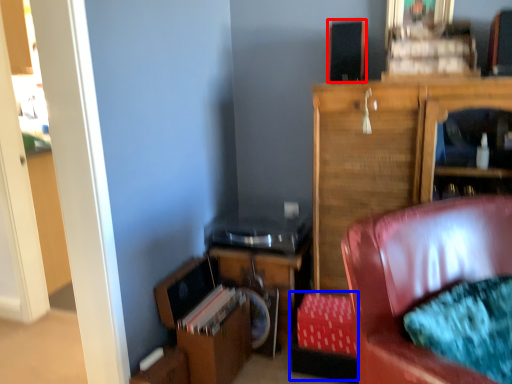
Question: Among these objects, which one is nearest to the camera, speaker (highlighted by a red box) or footrest (highlighted by a blue box)?

Choices:
 (A) speaker
 (B) footrest

Answer: (B)